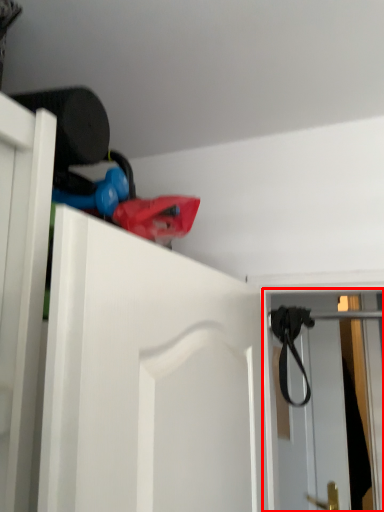
Question: From the image's perspective, what is the correct spatial relationship of screen door (annotated by the red box) in relation to strap?

Choices:
 (A) above
 (B) below

Answer: (B)